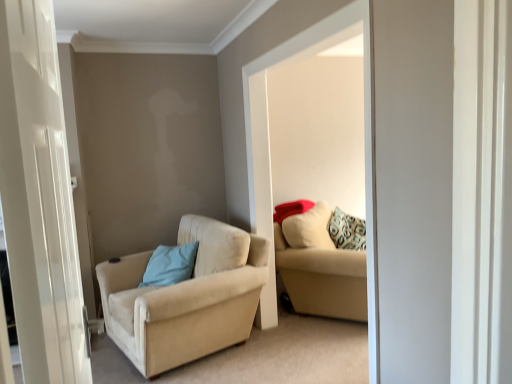
Question: In terms of height, does light blue fabric pillow at center-left look taller or shorter compared to beige fabric couch at center?

Choices:
 (A) short
 (B) tall

Answer: (A)

Question: From a real-world perspective, is light blue fabric pillow at center-left above or below beige fabric couch at center?

Choices:
 (A) below
 (B) above

Answer: (B)

Question: Estimate the real-world distances between objects in this image. Which object is farther from the beige fabric couch at center?

Choices:
 (A) beige fabric chair at left
 (B) white glossy door at left
 (C) beige fabric couch at center
 (D) light blue fabric pillow at center-left

Answer: (B)

Question: Estimate the real-world distances between objects in this image. Which object is closer to the beige fabric couch at center?

Choices:
 (A) beige fabric chair at left
 (B) light blue fabric pillow at center-left
 (C) white glossy door at left
 (D) beige fabric couch at center

Answer: (D)